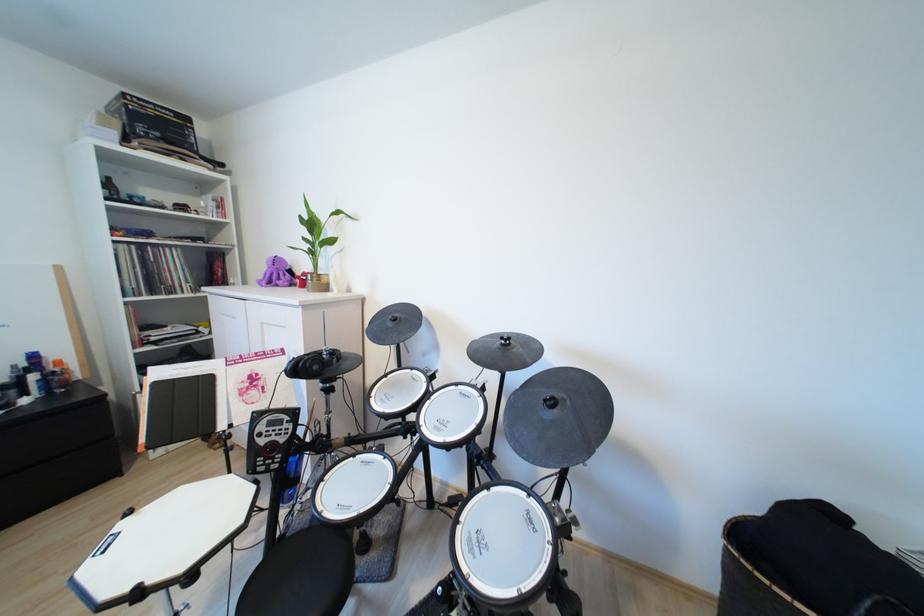
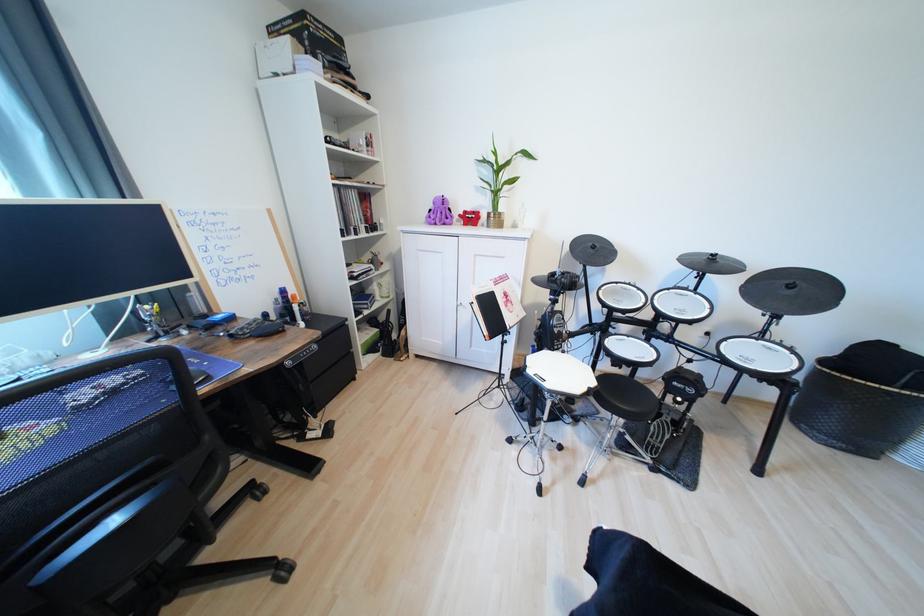
The point at (248, 395) is marked in the first image. Where is the corresponding point in the second image?

(513, 307)